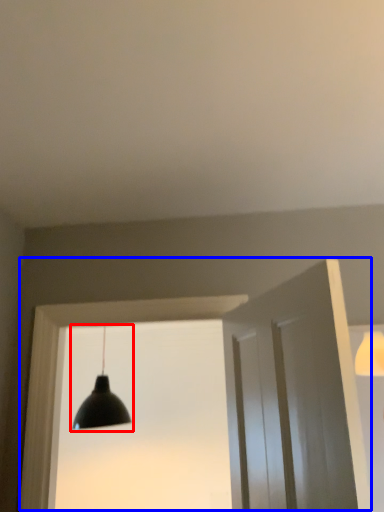
Question: Which object appears closest to the camera in this image, lamp (highlighted by a red box) or window frame (highlighted by a blue box)?

Choices:
 (A) lamp
 (B) window frame

Answer: (B)